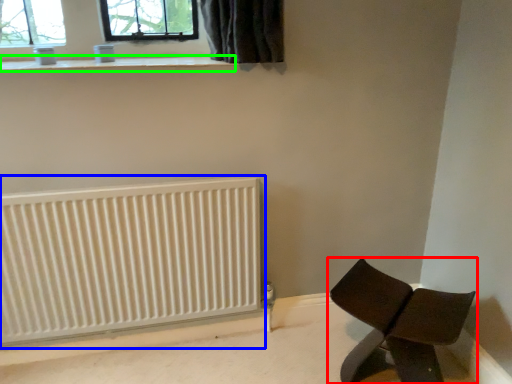
Question: Which object is the closest to the furniture (highlighted by a red box)? Choose among these: radiator (highlighted by a blue box) or window sill (highlighted by a green box).

Choices:
 (A) radiator
 (B) window sill

Answer: (A)